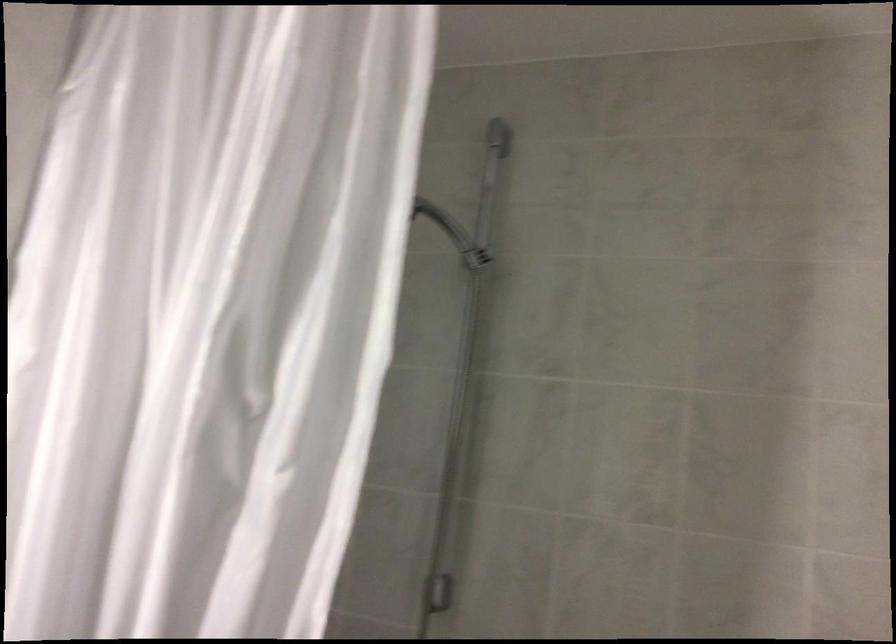
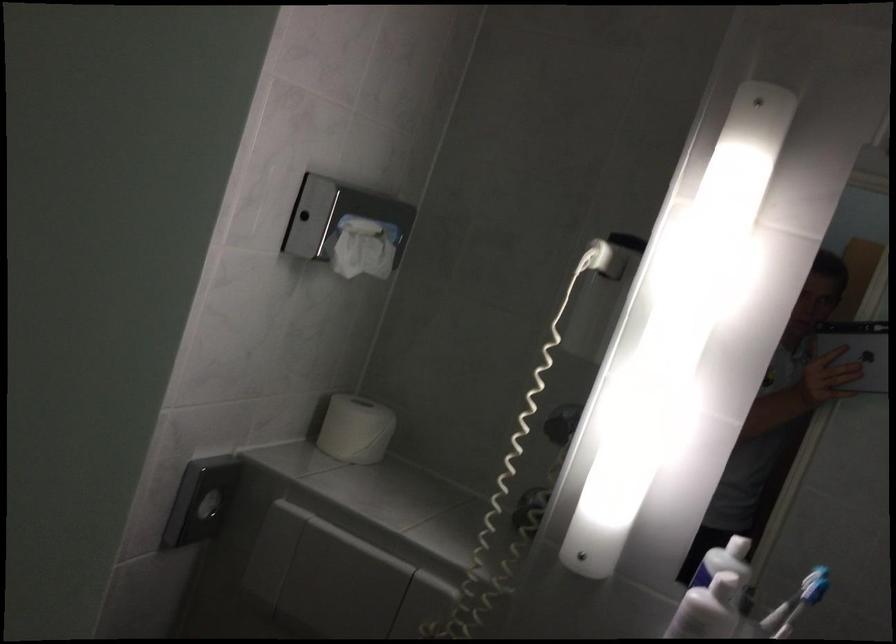
Question: The first image is from the beginning of the video and the second image is from the end. How did the camera likely rotate when shooting the video?

Choices:
 (A) Left
 (B) Right
 (C) Up
 (D) Down

Answer: (A)